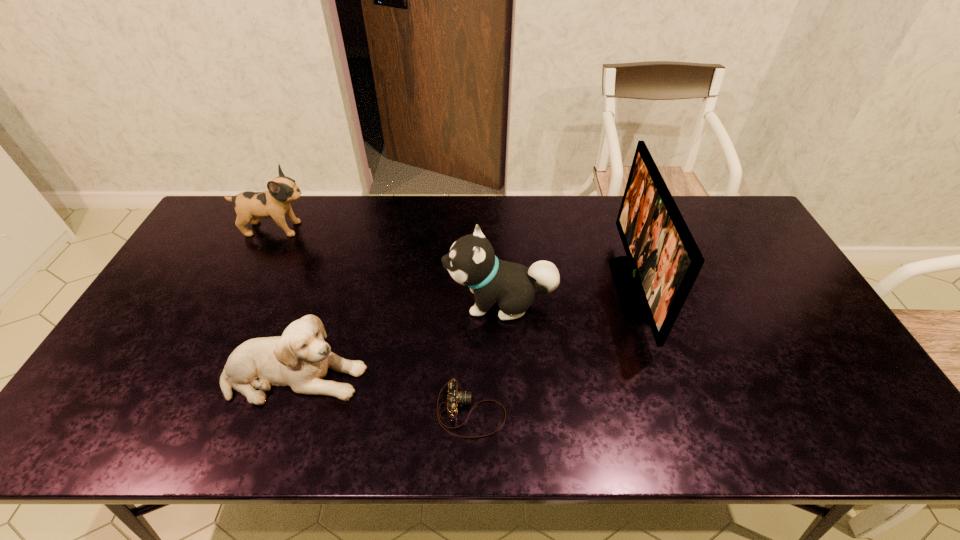
At what (x,y) coordinates should I click in order to perform the action: click on free space between the camera and the rightmost object. Please return your answer as a coordinate pair (x, y). This screenshot has width=960, height=540. Looking at the image, I should click on (552, 350).

Find the location of a particular element. The width and height of the screenshot is (960, 540). vacant space that's between the nearest puppy and the rightmost object is located at coordinates (464, 333).

This screenshot has width=960, height=540. I want to click on vacant space that is in between the nearest puppy and the monitor, so click(464, 333).

Image resolution: width=960 pixels, height=540 pixels. I want to click on vacant space that's between the monitor and the shortest object, so click(x=552, y=350).

At what (x,y) coordinates should I click in order to perform the action: click on blank region between the shortest puppy and the second nearest puppy. Please return your answer as a coordinate pair (x, y). The height and width of the screenshot is (540, 960). Looking at the image, I should click on (397, 339).

This screenshot has height=540, width=960. What are the coordinates of `object identified as the fourth closest to the shortest object` in the screenshot? It's located at (250, 206).

Point out which object is positioned as the second nearest to the shortest object. Please provide its 2D coordinates. Your answer should be formatted as a tuple, i.e. [(x, y)], where the tuple contains the x and y coordinates of a point satisfying the conditions above.

[(471, 261)]

Identify the location of puppy that is the second nearest to the shortest object. (471, 261).

Select which puppy is the second closest to the farthest puppy. Please provide its 2D coordinates. Your answer should be formatted as a tuple, i.e. [(x, y)], where the tuple contains the x and y coordinates of a point satisfying the conditions above.

[(471, 261)]